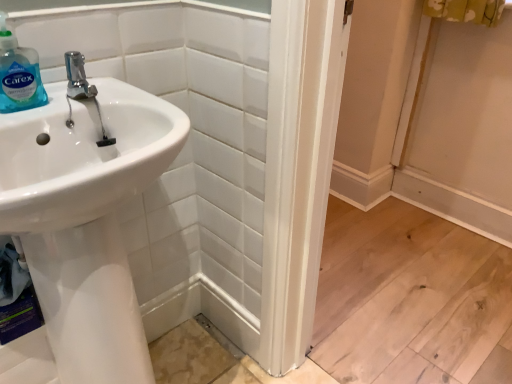
Question: Is polished chrome faucet at upper left facing away from white glossy sink at left?

Choices:
 (A) no
 (B) yes

Answer: (B)

Question: Is polished chrome faucet at upper left shorter than white glossy sink at left?

Choices:
 (A) no
 (B) yes

Answer: (B)

Question: Is polished chrome faucet at upper left aimed at white glossy sink at left?

Choices:
 (A) no
 (B) yes

Answer: (A)

Question: Is polished chrome faucet at upper left outside white glossy sink at left?

Choices:
 (A) no
 (B) yes

Answer: (B)

Question: Can you confirm if polished chrome faucet at upper left is smaller than white glossy sink at left?

Choices:
 (A) no
 (B) yes

Answer: (B)

Question: In the image, is polished chrome faucet at upper left positioned in front of or behind translucent plastic soap dispenser at upper left?

Choices:
 (A) front
 (B) behind

Answer: (B)

Question: Is polished chrome faucet at upper left to the left or to the right of translucent plastic soap dispenser at upper left in the image?

Choices:
 (A) left
 (B) right

Answer: (B)

Question: Which is correct: polished chrome faucet at upper left is inside translucent plastic soap dispenser at upper left, or outside of it?

Choices:
 (A) outside
 (B) inside

Answer: (A)

Question: From the image's perspective, is polished chrome faucet at upper left above or below translucent plastic soap dispenser at upper left?

Choices:
 (A) above
 (B) below

Answer: (B)

Question: In terms of height, does translucent plastic soap dispenser at upper left look taller or shorter compared to polished chrome faucet at upper left?

Choices:
 (A) tall
 (B) short

Answer: (A)

Question: Considering the positions of translucent plastic soap dispenser at upper left and polished chrome faucet at upper left in the image, is translucent plastic soap dispenser at upper left wider or thinner than polished chrome faucet at upper left?

Choices:
 (A) wide
 (B) thin

Answer: (B)

Question: From a real-world perspective, is translucent plastic soap dispenser at upper left above or below polished chrome faucet at upper left?

Choices:
 (A) above
 (B) below

Answer: (A)

Question: Looking at the image, does translucent plastic soap dispenser at upper left seem bigger or smaller compared to polished chrome faucet at upper left?

Choices:
 (A) big
 (B) small

Answer: (A)

Question: Relative to white glossy sink at left, is polished chrome faucet at upper left in front or behind?

Choices:
 (A) behind
 (B) front

Answer: (A)

Question: From the image's perspective, is polished chrome faucet at upper left located above or below white glossy sink at left?

Choices:
 (A) above
 (B) below

Answer: (A)